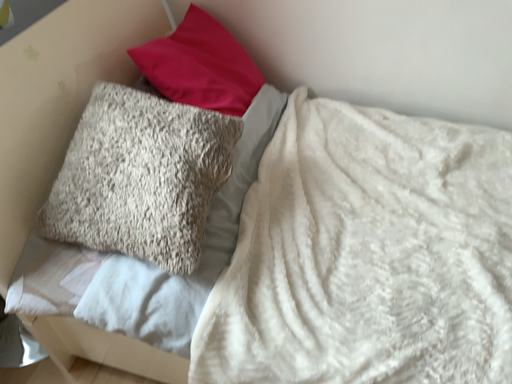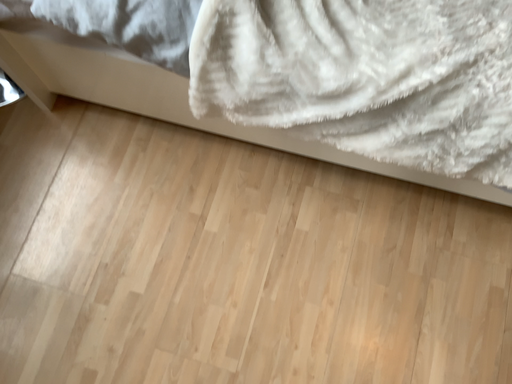
Question: How did the camera likely rotate when shooting the video?

Choices:
 (A) rotated downward
 (B) rotated upward

Answer: (A)